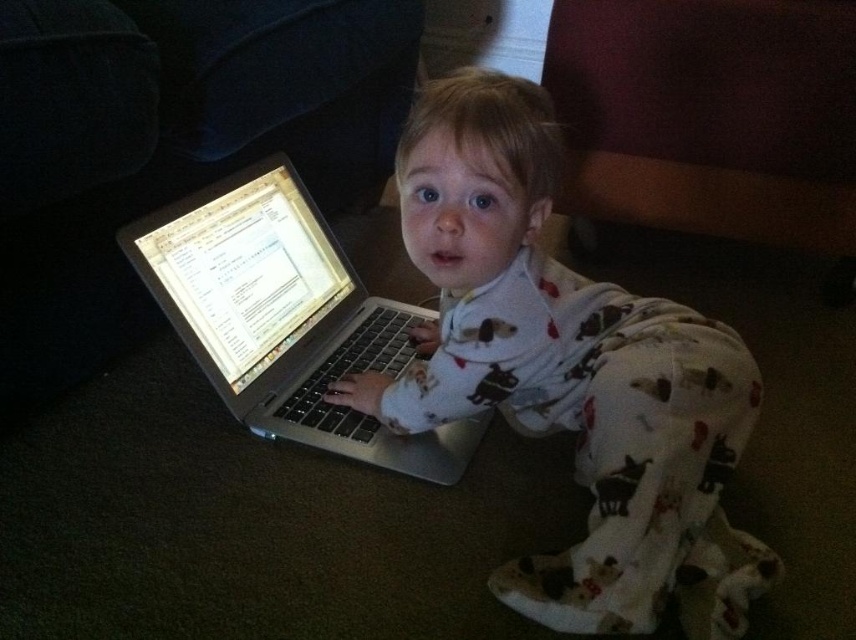
Which is more to the right, white soft pajamas at center or silver metallic laptop at center?

white soft pajamas at center

Between point (661, 413) and point (235, 211), which one is positioned in front?

Point (661, 413)

The height and width of the screenshot is (640, 856). Describe the element at coordinates (569, 374) in the screenshot. I see `white soft pajamas at center` at that location.

Locate an element on the screen. The image size is (856, 640). white soft pajamas at center is located at coordinates (569, 374).